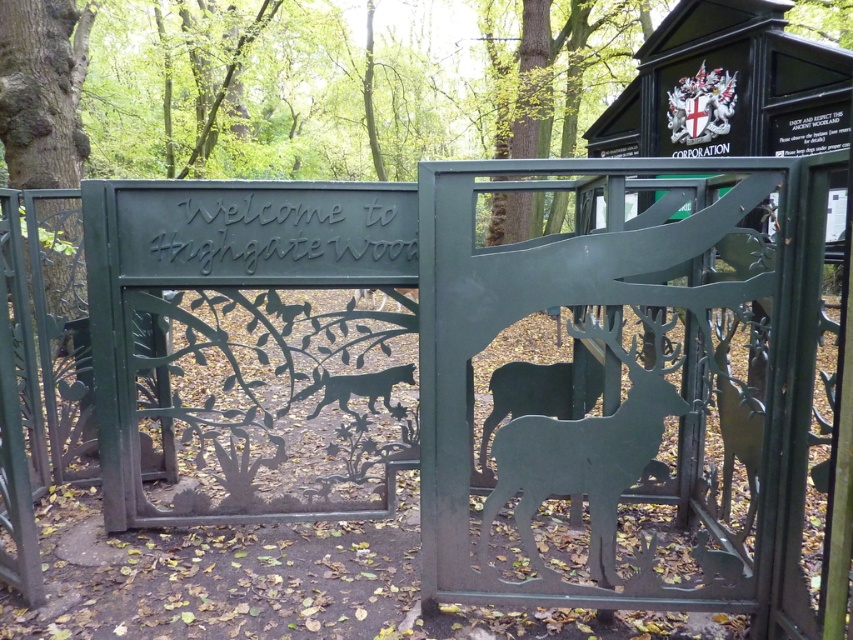
Is green matte deer at center shorter than silhouette metal wolf at center?

In fact, green matte deer at center may be taller than silhouette metal wolf at center.

Does green matte deer at center appear under silhouette metal wolf at center?

Indeed, green matte deer at center is positioned under silhouette metal wolf at center.

Who is more forward, [558,461] or [407,376]?

Point [558,461] is more forward.

Where is `green matte deer at center`? This screenshot has width=853, height=640. green matte deer at center is located at coordinates (583, 454).

Is green metal gate at right above black matte deer at center?

Correct, green metal gate at right is located above black matte deer at center.

Between green metal gate at right and black matte deer at center, which one has less height?

Standing shorter between the two is black matte deer at center.

Who is more forward, [799,492] or [488,436]?

Point [799,492] is more forward.

Identify the location of green metal gate at right. Image resolution: width=853 pixels, height=640 pixels. (840, 451).

The height and width of the screenshot is (640, 853). What do you see at coordinates (583, 454) in the screenshot?
I see `green matte deer at center` at bounding box center [583, 454].

Does green matte deer at center have a smaller size compared to black matte deer at center?

No, green matte deer at center is not smaller than black matte deer at center.

Which is behind, point (486, 544) or point (485, 444)?

Point (485, 444)

This screenshot has height=640, width=853. Find the location of `green matte deer at center`. green matte deer at center is located at coordinates (583, 454).